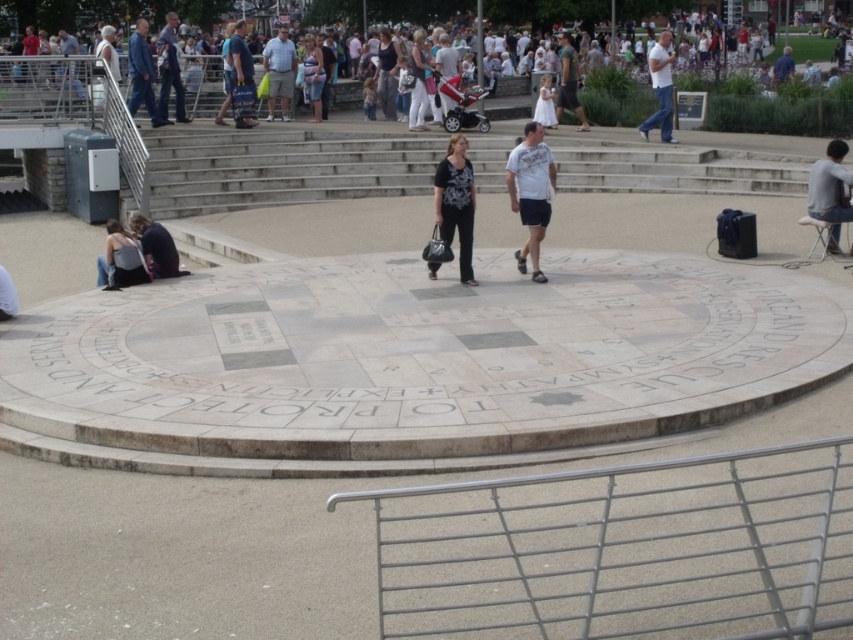
Which is behind, point (206, 28) or point (96, 264)?

Positioned behind is point (206, 28).

Is white cotton dress at upper center smaller than matte black tank top at lower left?

No, white cotton dress at upper center is not smaller than matte black tank top at lower left.

Is point (457, 0) positioned before point (112, 253)?

No, (457, 0) is further to viewer.

Image resolution: width=853 pixels, height=640 pixels. Find the location of `white cotton dress at upper center`. white cotton dress at upper center is located at coordinates (103, 12).

Can you confirm if matte black tank top at lower left is positioned to the left of blue denim jacket at upper left?

Incorrect, matte black tank top at lower left is not on the left side of blue denim jacket at upper left.

Between matte black tank top at lower left and blue denim jacket at upper left, which one has less height?

matte black tank top at lower left is shorter.

Is point (119, 257) positioned in front of point (131, 83)?

Yes.

Image resolution: width=853 pixels, height=640 pixels. In order to click on matte black tank top at lower left in this screenshot , I will do `click(120, 259)`.

Which of these two, white cotton t-shirt at center or denim shorts at center, stands shorter?

With less height is white cotton t-shirt at center.

Is white cotton t-shirt at center to the right of denim shorts at center from the viewer's perspective?

Yes, white cotton t-shirt at center is to the right of denim shorts at center.

Between point (552, 182) and point (321, 58), which one is positioned in front?

Positioned in front is point (552, 182).

The height and width of the screenshot is (640, 853). I want to click on white cotton t-shirt at center, so click(x=531, y=193).